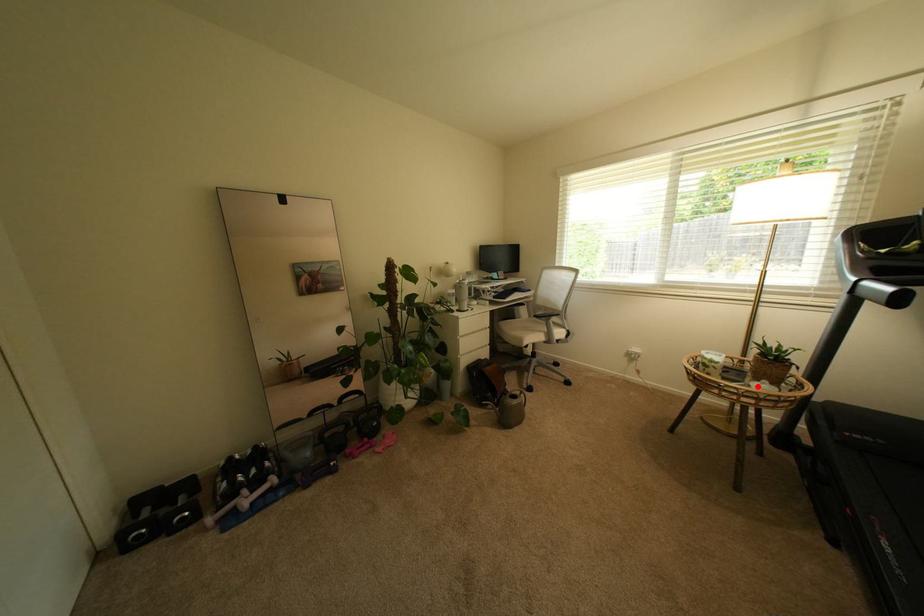
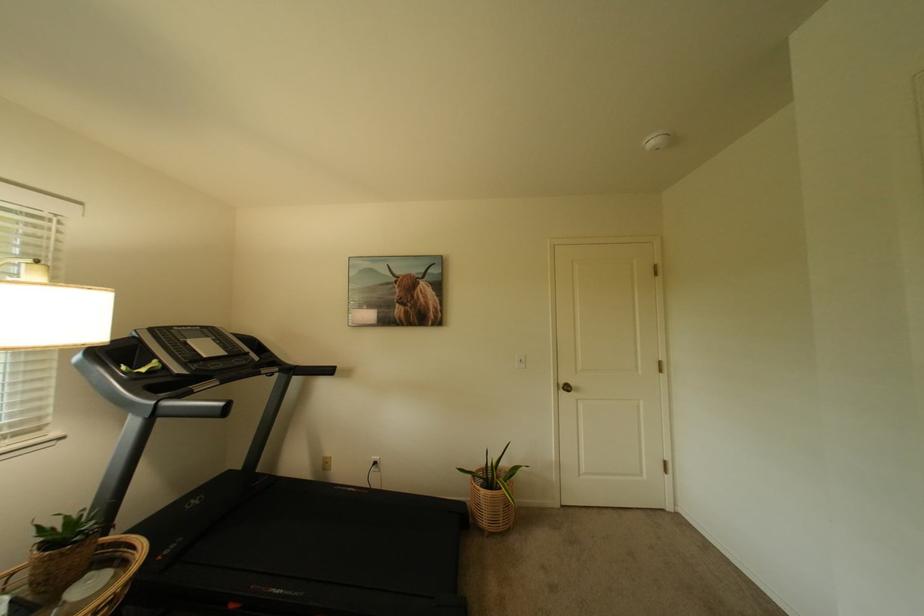
Question: I am providing you with two images of the same scene from different viewpoints. In image1, a red point is highlighted. Considering the same 3D point in image2, which of the following is correct?

Choices:
 (A) It is closer
 (B) It is farther

Answer: (A)